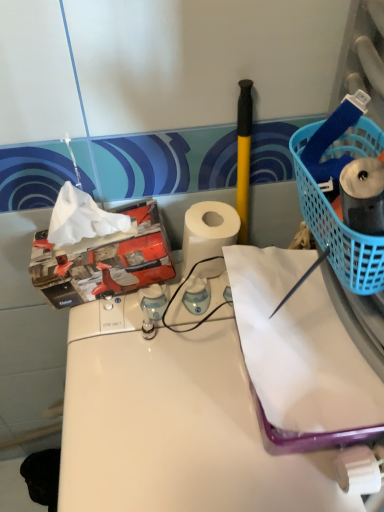
Question: Would you consider white glossy counter at center to be distant from blue plastic basket at right?

Choices:
 (A) yes
 (B) no

Answer: (B)

Question: Can you confirm if white glossy counter at center is shorter than blue plastic basket at right?

Choices:
 (A) yes
 (B) no

Answer: (B)

Question: From the image's perspective, is white glossy counter at center under blue plastic basket at right?

Choices:
 (A) yes
 (B) no

Answer: (A)

Question: Is white glossy counter at center oriented towards blue plastic basket at right?

Choices:
 (A) yes
 (B) no

Answer: (B)

Question: From a real-world perspective, is white glossy counter at center positioned over blue plastic basket at right based on gravity?

Choices:
 (A) no
 (B) yes

Answer: (A)

Question: Does white glossy counter at center have a larger size compared to blue plastic basket at right?

Choices:
 (A) no
 (B) yes

Answer: (B)

Question: Can you confirm if white glossy counter at center is thinner than white matte paper at center?

Choices:
 (A) yes
 (B) no

Answer: (B)

Question: Can you confirm if white glossy counter at center is bigger than white matte paper at center?

Choices:
 (A) no
 (B) yes

Answer: (B)

Question: From the image's perspective, does white glossy counter at center appear higher than white matte paper at center?

Choices:
 (A) yes
 (B) no

Answer: (B)

Question: Is white glossy counter at center further to the viewer compared to white matte paper at center?

Choices:
 (A) yes
 (B) no

Answer: (B)

Question: Is white glossy counter at center positioned with its back to white matte paper at center?

Choices:
 (A) yes
 (B) no

Answer: (B)

Question: Considering the relative sizes of white glossy counter at center and white matte paper at center in the image provided, is white glossy counter at center taller than white matte paper at center?

Choices:
 (A) yes
 (B) no

Answer: (A)

Question: Is blue plastic basket at right oriented towards white matte paper at center?

Choices:
 (A) no
 (B) yes

Answer: (A)